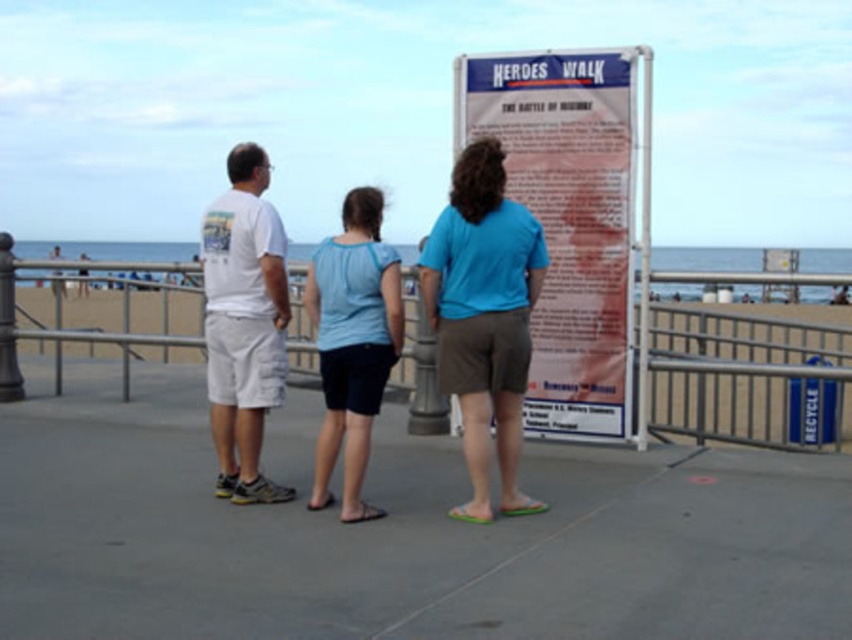
Question: Can you confirm if white paper sign at center is bigger than light blue fabric shirt at center?

Choices:
 (A) no
 (B) yes

Answer: (B)

Question: Is white paper sign at center smaller than light blue fabric shirt at center?

Choices:
 (A) yes
 (B) no

Answer: (B)

Question: Among these objects, which one is farthest from the camera?

Choices:
 (A) white cotton t-shirt at left
 (B) blue cotton shirt at center
 (C) metallic gray railing at center

Answer: (C)

Question: Which of the following is the farthest from the observer?

Choices:
 (A) white paper sign at center
 (B) white cotton t-shirt at left
 (C) white cotton shirt at center
 (D) light blue fabric shirt at center

Answer: (A)

Question: Does metallic gray railing at center have a larger size compared to blue cotton shirt at center?

Choices:
 (A) yes
 (B) no

Answer: (A)

Question: Which of the following is the farthest from the observer?

Choices:
 (A) blue cotton shirt at center
 (B) white paper sign at center
 (C) white cotton t-shirt at left
 (D) light blue fabric shirt at center

Answer: (B)